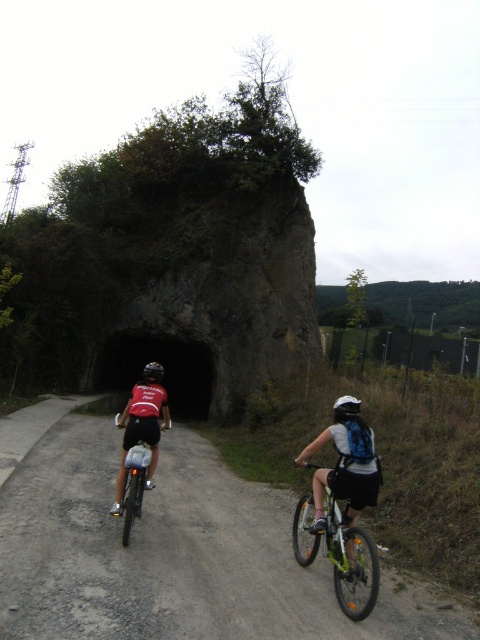
You are a photographer standing at the camera position. You want to take a photo of the white matte bicycle helmet at center. The focus range of your camera is 5 meters. Will the helmet be in focus?

The white matte bicycle helmet at center is 5.26 meters away from the camera. Since the focus range is 5 meters, the helmet is slightly out of focus range. Therefore, the helmet will not be in focus.